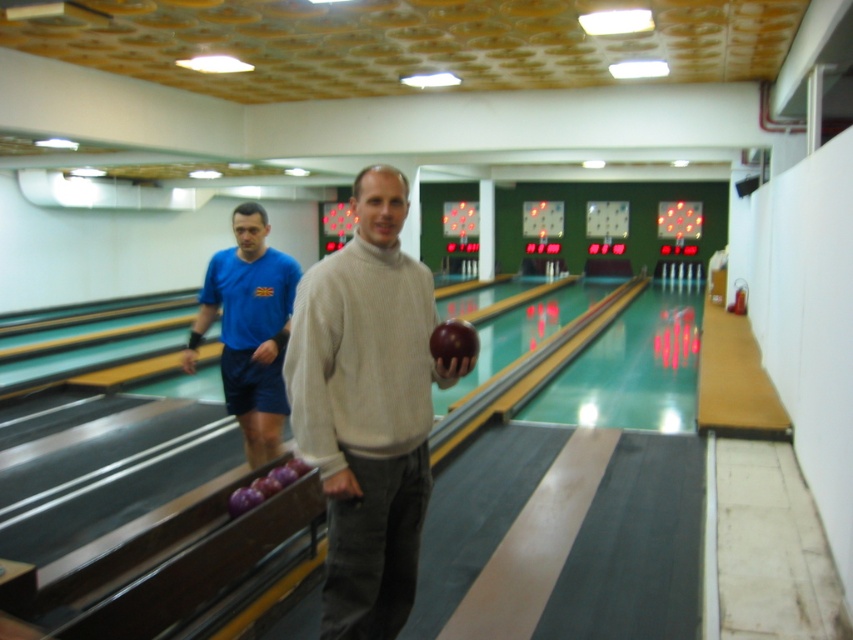
Between matte white sweater at center and shiny brown bowling ball at center, which one appears on the left side from the viewer's perspective?

matte white sweater at center

Describe the element at coordinates (367, 406) in the screenshot. This screenshot has width=853, height=640. I see `matte white sweater at center` at that location.

Who is more distant from viewer, (x=392, y=358) or (x=462, y=340)?

The point (x=462, y=340) is behind.

I want to click on matte white sweater at center, so click(x=367, y=406).

Does matte white sweater at center have a greater height compared to blue fabric shorts at left?

Correct, matte white sweater at center is much taller as blue fabric shorts at left.

Looking at this image, which is more to the right, matte white sweater at center or blue fabric shorts at left?

matte white sweater at center

Is point (392, 225) behind point (253, 458)?

No.

The image size is (853, 640). What are the coordinates of `matte white sweater at center` in the screenshot? It's located at (367, 406).

Looking at this image, does blue fabric shorts at left appear on the right side of shiny brown bowling ball at center?

Incorrect, blue fabric shorts at left is not on the right side of shiny brown bowling ball at center.

Which of these two, blue fabric shorts at left or shiny brown bowling ball at center, stands shorter?

shiny brown bowling ball at center is shorter.

Who is more distant from viewer, (274, 260) or (466, 352)?

Point (274, 260)

Where is `blue fabric shorts at left`? The width and height of the screenshot is (853, 640). blue fabric shorts at left is located at coordinates pos(248,328).